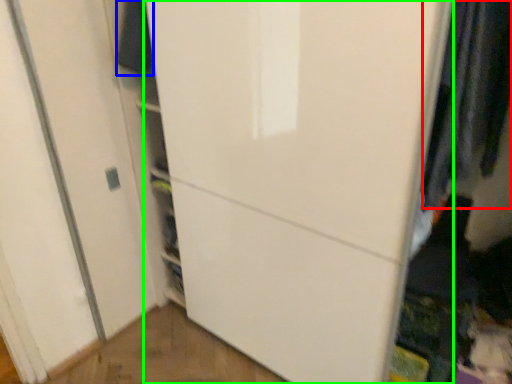
Question: Considering the real-world distances, which object is farthest from clothing (highlighted by a red box)? clothing (highlighted by a blue box) or door (highlighted by a green box)?

Choices:
 (A) clothing
 (B) door

Answer: (A)